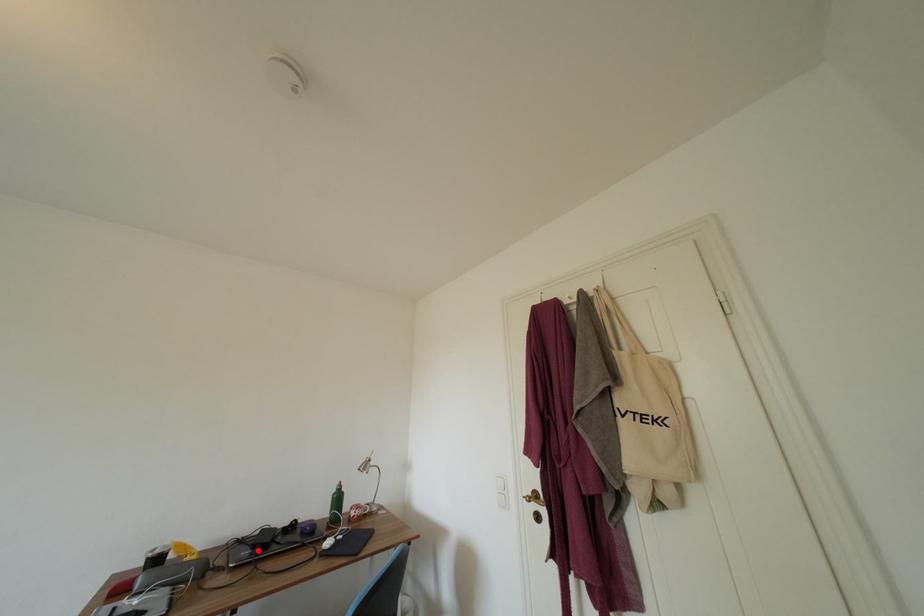
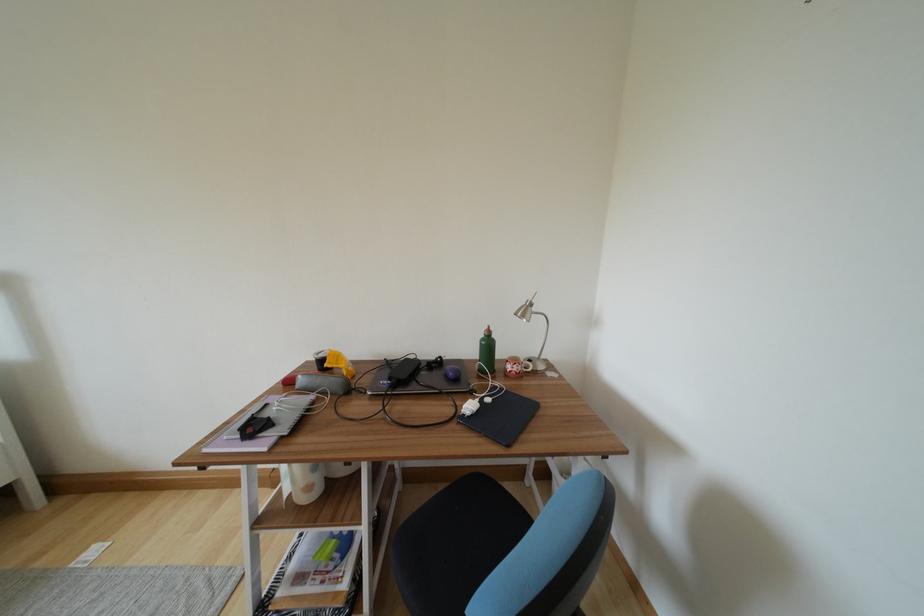
Locate, in the second image, the point that corresponds to the highlighted location in the first image.

(395, 382)